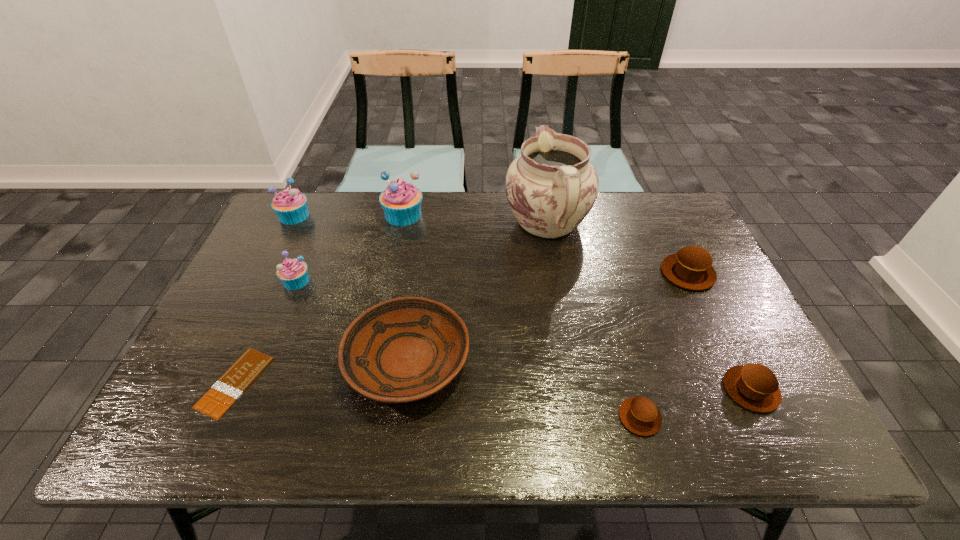
You are a GUI agent. You are given a task and a screenshot of the screen. Output one action in this format:
    pyautogui.click(x=<x>, y=<y>)
    Task: Click on the leftmost brown muffin
    
    Given the screenshot: What is the action you would take?
    pyautogui.click(x=639, y=415)

Find the location of a particular element. the second shortest object is located at coordinates (639, 415).

The height and width of the screenshot is (540, 960). Identify the location of chocolate bar. (227, 389).

Identify the location of free space located on the left of the second tallest object. The height and width of the screenshot is (540, 960). (343, 215).

The height and width of the screenshot is (540, 960). In order to click on vacant space situated 0.200m on the front of the seventh shortest object in this screenshot , I will do `click(268, 269)`.

The width and height of the screenshot is (960, 540). Find the location of `free location located on the front of the smallest blue muffin`. free location located on the front of the smallest blue muffin is located at coordinates (256, 377).

Locate an element on the screen. vacant space situated 0.220m on the left of the biggest brown muffin is located at coordinates (585, 273).

Locate an element on the screen. Image resolution: width=960 pixels, height=540 pixels. free space located on the right of the brown plate is located at coordinates click(x=629, y=360).

Where is `vacant space located on the back of the second smallest brown muffin`? The width and height of the screenshot is (960, 540). vacant space located on the back of the second smallest brown muffin is located at coordinates (693, 272).

The image size is (960, 540). Identify the location of vacant region located on the left of the second shortest object. (484, 417).